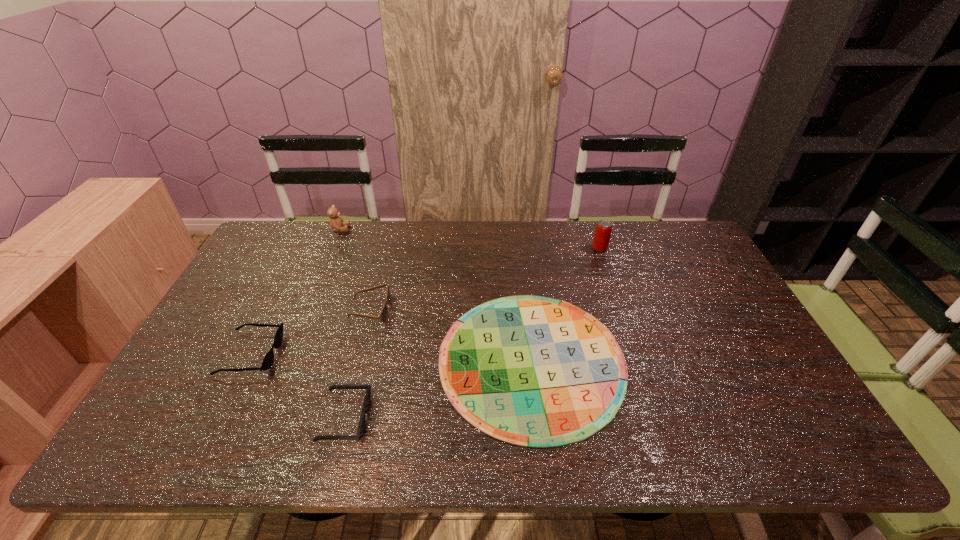
What are the coordinates of `object positioned at the left edge` in the screenshot? It's located at (267, 362).

You are a GUI agent. You are given a task and a screenshot of the screen. Output one action in this format:
    pyautogui.click(x=<x>, y=<y>)
    Task: Click on the vacant space at the far edge of the desktop
    
    Given the screenshot: What is the action you would take?
    pyautogui.click(x=390, y=228)

The image size is (960, 540). In the image, there is a desktop. Identify the location of vacant space at the near edge. (570, 449).

Identify the location of free region at the left edge. The width and height of the screenshot is (960, 540). (170, 390).

The image size is (960, 540). Identify the location of vacant space at the right edge of the desktop. click(710, 320).

At what (x,y) coordinates should I click in order to perform the action: click on vacant space at the far right corner of the desktop. Please return your answer as a coordinate pair (x, y). Image resolution: width=960 pixels, height=540 pixels. Looking at the image, I should click on (689, 249).

Where is `vacant region at the near right corner`? Image resolution: width=960 pixels, height=540 pixels. vacant region at the near right corner is located at coordinates (753, 430).

The height and width of the screenshot is (540, 960). I want to click on empty space that is in between the farthest object and the nearest sunglasses, so click(x=343, y=324).

Image resolution: width=960 pixels, height=540 pixels. In order to click on blank region between the second farthest object and the leftmost sunglasses in this screenshot , I will do `click(425, 301)`.

Where is `free space between the teddy bear and the shortest object`? free space between the teddy bear and the shortest object is located at coordinates (436, 295).